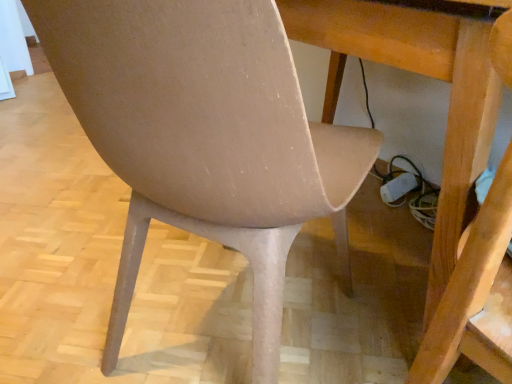
I want to click on free spot below matte beige chair at center (from a real-world perspective), so click(x=223, y=321).